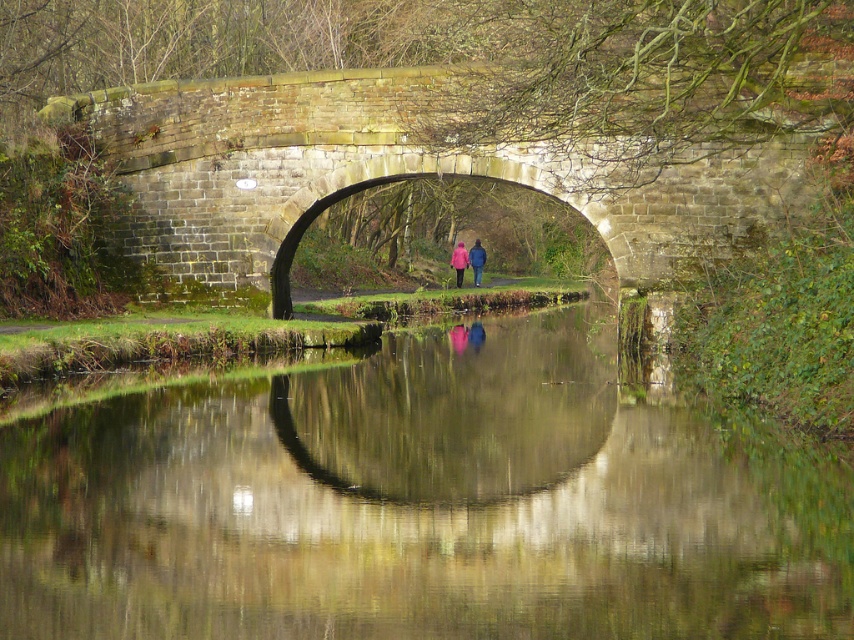
You are a photographer standing at the base of the stone bridge and want to take a picture of the matte pink coat at center. Where should you position yourself to capture the coat in the frame?

To capture the matte pink coat at center in the frame, position yourself at the base of the stone bridge facing towards the coat, as its 2D location is at point (468, 260), which places it centrally in the scene.

You are standing on the stone bridge and want to take a photo of the smooth reflective water at center and the matte pink coat at center. Which object will appear closer to the camera in the photo?

The smooth reflective water at center will appear closer to the camera in the photo because it is in front of the matte pink coat at center.

You are standing on the stone bridge at center and notice a person wearing a matte pink coat at center walking towards you. If the bridge is wide enough, you can both pass each other without needing to move sideways. Can you both pass each other comfortably?

The stone bridge at center is wider than the matte pink coat at center, so yes, you and the person in the matte pink coat at center can pass each other comfortably on the bridge since the bridge is wider than the person.